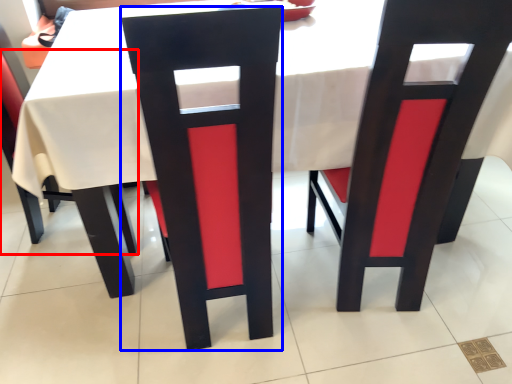
Question: Which of the following is the farthest to the observer, chair (highlighted by a red box) or chair (highlighted by a blue box)?

Choices:
 (A) chair
 (B) chair

Answer: (A)